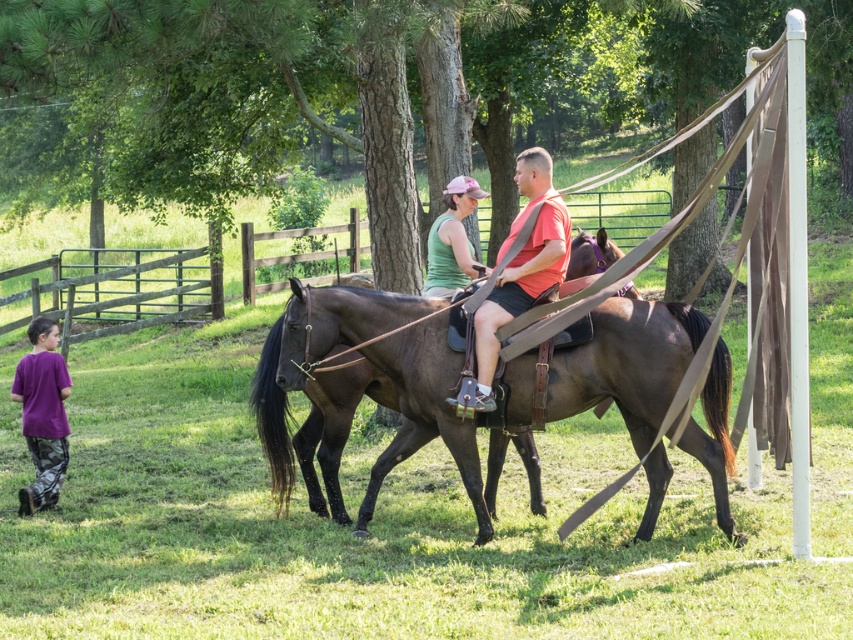
Is matte brown leather saddle at center below purple cotton shirt at lower left?

No.

Who is more distant from viewer, [543,266] or [51,401]?

The point [51,401] is behind.

Who is more forward, [550,227] or [50,461]?

Point [550,227]

Identify the location of matte brown leather saddle at center. (521, 264).

Which is behind, point (62, 420) or point (427, 268)?

The point (427, 268) is more distant.

Is purple cotton shirt at lower left thinner than matte green tank top at center?

No.

What do you see at coordinates (42, 413) in the screenshot? The height and width of the screenshot is (640, 853). I see `purple cotton shirt at lower left` at bounding box center [42, 413].

Where is `purple cotton shirt at lower left`? Image resolution: width=853 pixels, height=640 pixels. purple cotton shirt at lower left is located at coordinates (42, 413).

Does point (653, 330) come behind point (456, 259)?

No, (653, 330) is closer to viewer.

Does point (439, 348) come in front of point (463, 188)?

Yes, point (439, 348) is closer to viewer.

This screenshot has height=640, width=853. Describe the element at coordinates (627, 364) in the screenshot. I see `shiny brown horse at center` at that location.

What are the coordinates of `shiny brown horse at center` in the screenshot? It's located at (627, 364).